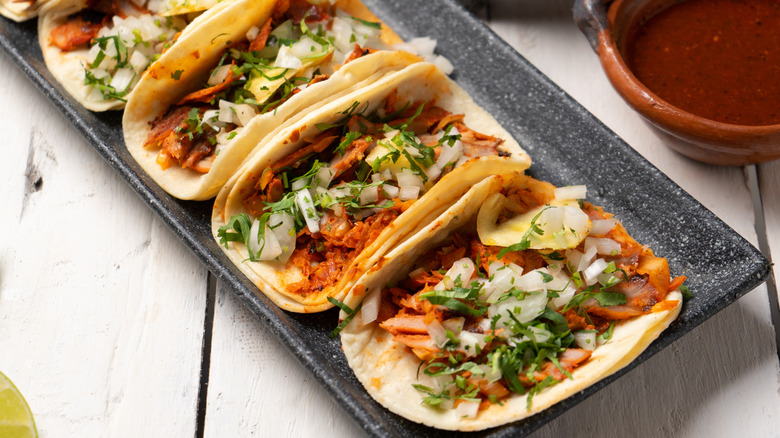
The width and height of the screenshot is (780, 438). Identify the location of white tablecloth. (564, 66), (110, 275), (139, 409), (9, 141).